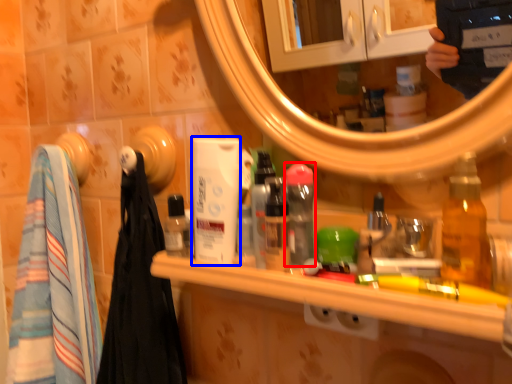
Question: Which object is further to the camera taking this photo, mouthwash (highlighted by a red box) or mouthwash (highlighted by a blue box)?

Choices:
 (A) mouthwash
 (B) mouthwash

Answer: (B)